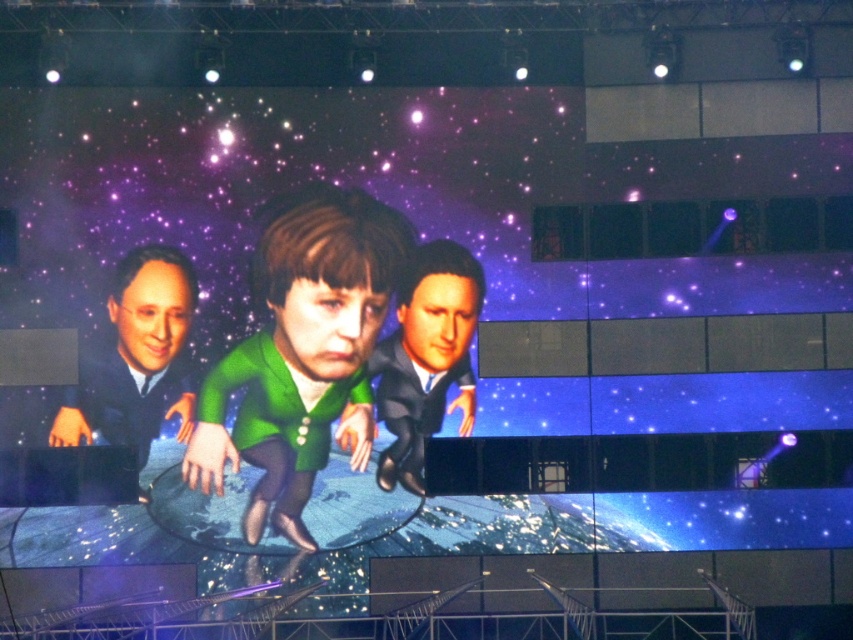
Question: Which point is farther to the camera?

Choices:
 (A) smooth black suit at center
 (B) green matte jacket at center
 (C) matte black suit at left

Answer: (A)

Question: Can you confirm if green matte jacket at center is thinner than smooth black suit at center?

Choices:
 (A) yes
 (B) no

Answer: (B)

Question: Which of these objects is positioned closest to the smooth black suit at center?

Choices:
 (A) green matte jacket at center
 (B) matte black suit at left

Answer: (A)

Question: Is matte black suit at left above smooth black suit at center?

Choices:
 (A) yes
 (B) no

Answer: (A)

Question: Considering the real-world distances, which object is closest to the green matte jacket at center?

Choices:
 (A) matte black suit at left
 (B) smooth black suit at center

Answer: (B)

Question: Is green matte jacket at center above smooth black suit at center?

Choices:
 (A) no
 (B) yes

Answer: (B)